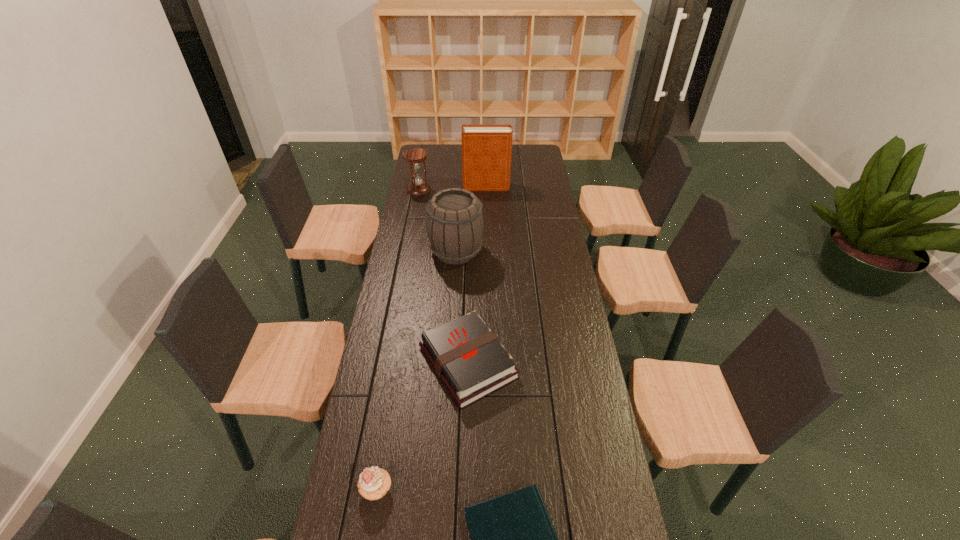
The width and height of the screenshot is (960, 540). In order to click on the tallest book in this screenshot , I will do `click(486, 149)`.

I want to click on the tallest object, so click(x=486, y=149).

Locate an element on the screen. wine bucket is located at coordinates (455, 223).

Identify the location of the second tallest object. (455, 223).

Locate an element on the screen. This screenshot has height=540, width=960. the third tallest object is located at coordinates (414, 156).

Where is `the third shortest object`? the third shortest object is located at coordinates (374, 482).

Locate an element on the screen. The height and width of the screenshot is (540, 960). the second farthest book is located at coordinates (467, 356).

Find the location of `the fifth tallest object`. the fifth tallest object is located at coordinates (467, 356).

Image resolution: width=960 pixels, height=540 pixels. What are the coordinates of `free space located 0.050m on the open cover of the tallest book` in the screenshot? It's located at (454, 187).

Identify the location of free space located 0.080m on the open cover of the tallest book. The height and width of the screenshot is (540, 960). (448, 187).